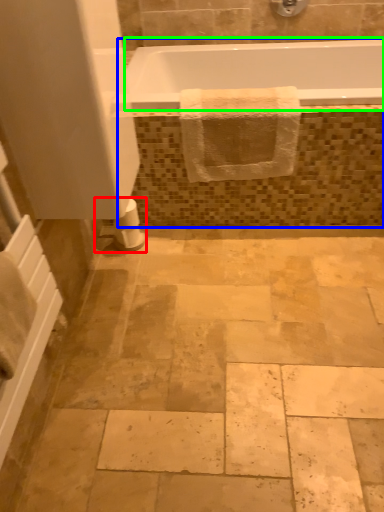
Question: Considering the real-world distances, which object is closest to toilet paper (highlighted by a red box)? bath (highlighted by a blue box) or bathtub (highlighted by a green box).

Choices:
 (A) bath
 (B) bathtub

Answer: (A)